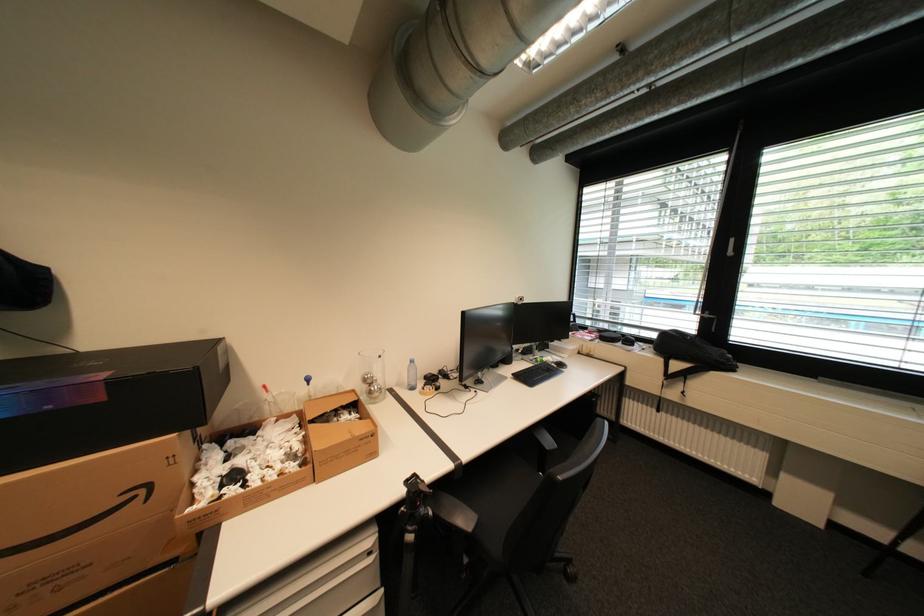
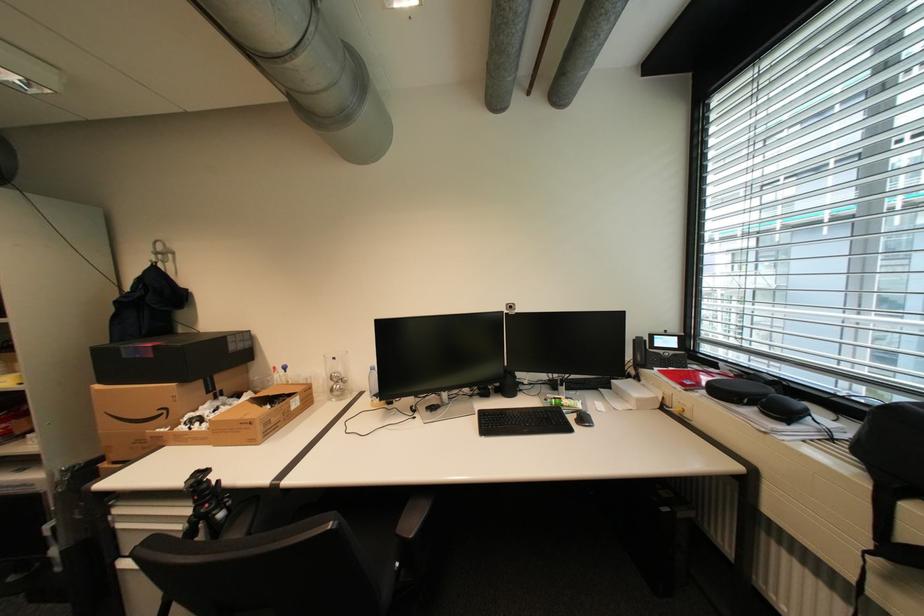
The point at (381, 436) is marked in the first image. Where is the corresponding point in the second image?

(259, 424)